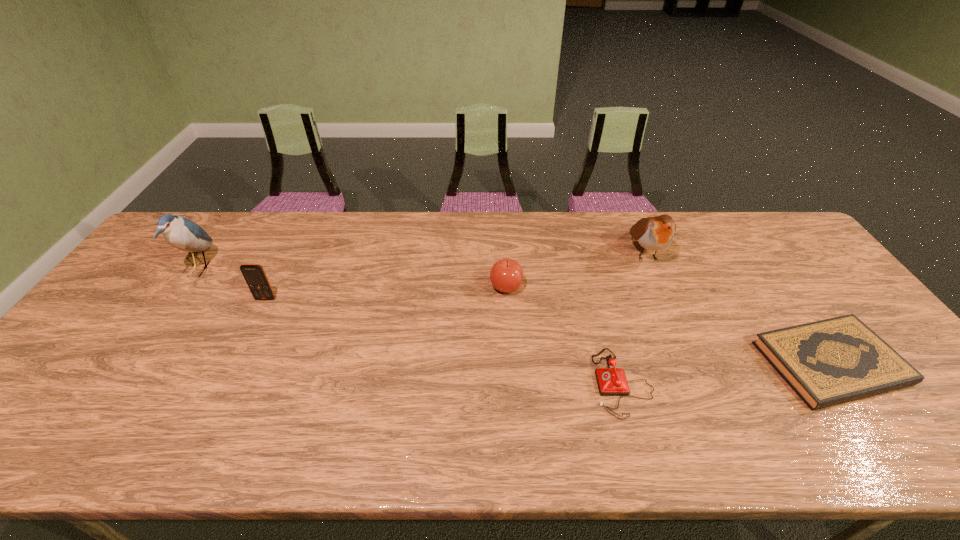
Identify the location of free spot located at the tip of the left bird's beak. (300, 269).

You are a GUI agent. You are given a task and a screenshot of the screen. Output one action in this format:
    pyautogui.click(x=<x>, y=<y>)
    Task: Click on the vacant space located 0.110m at the face of the second tallest object
    This screenshot has height=540, width=960.
    Given the screenshot: What is the action you would take?
    pyautogui.click(x=666, y=302)

The width and height of the screenshot is (960, 540). In order to click on free region located 0.250m on the screen of the cellular telephone in this screenshot , I will do `click(228, 375)`.

In order to click on vacant space situated on the front of the fourth tallest object in this screenshot , I will do (x=508, y=312).

The image size is (960, 540). I want to click on free location located 0.390m on the dial of the telephone, so click(430, 383).

At what (x,y) coordinates should I click in order to perform the action: click on free region located 0.350m on the dial of the telephone. Please return your answer as a coordinate pair (x, y). Looking at the image, I should click on (446, 383).

Locate an element on the screen. vacant region located on the dial of the telephone is located at coordinates (492, 383).

Image resolution: width=960 pixels, height=540 pixels. Find the location of `free space located on the left of the rightmost object`. free space located on the left of the rightmost object is located at coordinates (687, 363).

Where is `object that is at the near edge`? object that is at the near edge is located at coordinates (611, 381).

Image resolution: width=960 pixels, height=540 pixels. I want to click on object located at the left edge, so click(181, 233).